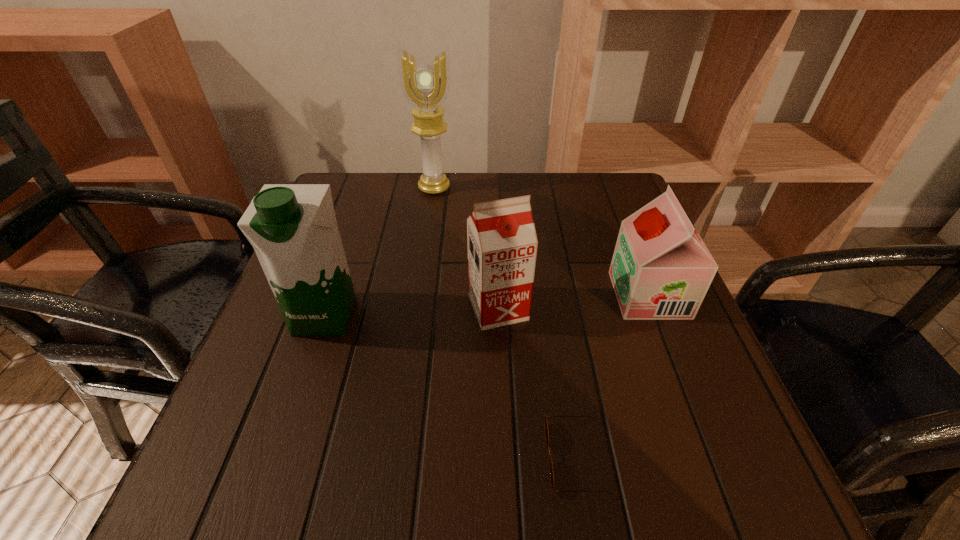
Locate an element on the screen. vacant space located on the right of the second soya milk from left to right is located at coordinates (644, 308).

Identify the location of vacant space situated with the cap open on the shortest soya milk. This screenshot has width=960, height=540. (591, 295).

The width and height of the screenshot is (960, 540). Identify the location of vacant space situated with the cap open on the shortest soya milk. (469, 295).

The height and width of the screenshot is (540, 960). In order to click on free space located 0.340m with the cap open on the shortest soya milk in this screenshot , I will do `click(449, 295)`.

Identify the location of free space located on the face of the sunglasses. (312, 457).

Identify the location of free region located on the face of the sunglasses. The image size is (960, 540). (473, 457).

Image resolution: width=960 pixels, height=540 pixels. What are the coordinates of `blank area located on the face of the sunglasses` in the screenshot? It's located at (440, 457).

Where is `object that is at the far edge`? object that is at the far edge is located at coordinates (425, 84).

Where is `object that is at the near edge`? This screenshot has height=540, width=960. object that is at the near edge is located at coordinates (545, 420).

In order to click on object situated at the left edge in this screenshot , I will do `click(293, 229)`.